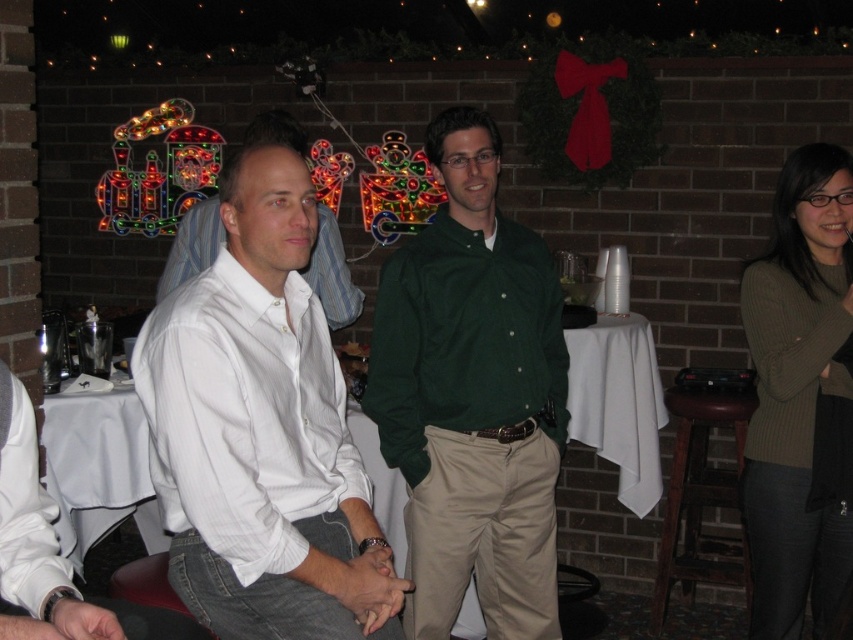
Can you confirm if green matte shirt at center is wider than knit green sweater at right?

Correct, the width of green matte shirt at center exceeds that of knit green sweater at right.

Based on the photo, does green matte shirt at center have a smaller size compared to knit green sweater at right?

Incorrect, green matte shirt at center is not smaller in size than knit green sweater at right.

Which is behind, point (393, 349) or point (836, 346)?

Point (393, 349)

Identify the location of green matte shirt at center. This screenshot has height=640, width=853. (473, 397).

In the scene shown: Does white cotton shirt at center appear on the right side of white matte shirt at left?

Indeed, white cotton shirt at center is positioned on the right side of white matte shirt at left.

Where is `white cotton shirt at center`? The height and width of the screenshot is (640, 853). white cotton shirt at center is located at coordinates (260, 432).

Does point (206, 419) come farther from viewer compared to point (753, 630)?

No, it is not.

Looking at this image, does white cotton shirt at center have a greater height compared to knit green sweater at right?

No, white cotton shirt at center is not taller than knit green sweater at right.

The image size is (853, 640). What do you see at coordinates (260, 432) in the screenshot? I see `white cotton shirt at center` at bounding box center [260, 432].

You are a GUI agent. You are given a task and a screenshot of the screen. Output one action in this format:
    pyautogui.click(x=<x>, y=<y>)
    Task: Click on the white cotton shirt at center
    The height and width of the screenshot is (640, 853).
    Given the screenshot: What is the action you would take?
    pyautogui.click(x=260, y=432)